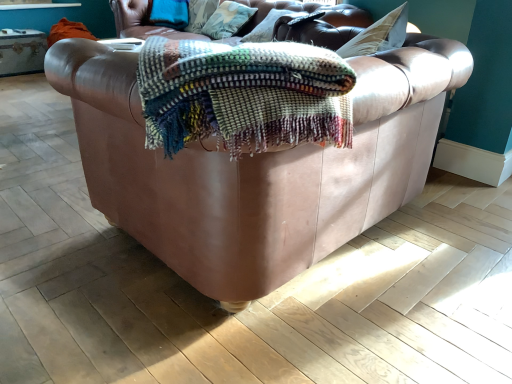
Question: Does velvet cushion at upper center, the 1th pillow from the right, lie in front of textured cotton pillow at upper center, acting as the first pillow starting from the left?

Choices:
 (A) no
 (B) yes

Answer: (B)

Question: Does velvet cushion at upper center, the 1th pillow from the right, appear on the left side of textured cotton pillow at upper center, which is counted as the second pillow, starting from the right?

Choices:
 (A) yes
 (B) no

Answer: (B)

Question: Is textured cotton pillow at upper center, acting as the first pillow starting from the left, at the back of velvet cushion at upper center, the 1th pillow from the right?

Choices:
 (A) yes
 (B) no

Answer: (B)

Question: Is velvet cushion at upper center, the second pillow in the left-to-right sequence, smaller than textured cotton pillow at upper center, acting as the first pillow starting from the left?

Choices:
 (A) yes
 (B) no

Answer: (B)

Question: Is velvet cushion at upper center, the second pillow in the left-to-right sequence, far from textured cotton pillow at upper center, which is counted as the second pillow, starting from the right?

Choices:
 (A) no
 (B) yes

Answer: (A)

Question: In the image, is leather couch at center positioned in front of or behind velvet cushion at upper center, the second pillow in the left-to-right sequence?

Choices:
 (A) behind
 (B) front

Answer: (B)

Question: From their relative heights in the image, would you say leather couch at center is taller or shorter than velvet cushion at upper center, the 1th pillow from the right?

Choices:
 (A) short
 (B) tall

Answer: (B)

Question: Considering the positions of leather couch at center and velvet cushion at upper center, the second pillow in the left-to-right sequence, in the image, is leather couch at center bigger or smaller than velvet cushion at upper center, the second pillow in the left-to-right sequence,?

Choices:
 (A) big
 (B) small

Answer: (A)

Question: Considering the relative positions of leather couch at center and velvet cushion at upper center, the 1th pillow from the right, in the image provided, is leather couch at center to the left or to the right of velvet cushion at upper center, the 1th pillow from the right,?

Choices:
 (A) left
 (B) right

Answer: (A)

Question: Is velvet cushion at upper center, the second pillow in the left-to-right sequence, wider or thinner than textured cotton pillow at upper center, acting as the first pillow starting from the left?

Choices:
 (A) wide
 (B) thin

Answer: (A)

Question: Would you say velvet cushion at upper center, the second pillow in the left-to-right sequence, is to the left or to the right of textured cotton pillow at upper center, acting as the first pillow starting from the left, in the picture?

Choices:
 (A) left
 (B) right

Answer: (B)

Question: Would you say velvet cushion at upper center, the second pillow in the left-to-right sequence, is inside or outside textured cotton pillow at upper center, which is counted as the second pillow, starting from the right?

Choices:
 (A) inside
 (B) outside

Answer: (B)

Question: Relative to textured cotton pillow at upper center, which is counted as the second pillow, starting from the right, is velvet cushion at upper center, the second pillow in the left-to-right sequence, in front or behind?

Choices:
 (A) behind
 (B) front

Answer: (B)

Question: Is leather couch at center inside the boundaries of textured cotton pillow at upper center, acting as the first pillow starting from the left, or outside?

Choices:
 (A) inside
 (B) outside

Answer: (B)

Question: Is leather couch at center in front of or behind textured cotton pillow at upper center, which is counted as the second pillow, starting from the right, in the image?

Choices:
 (A) behind
 (B) front

Answer: (B)